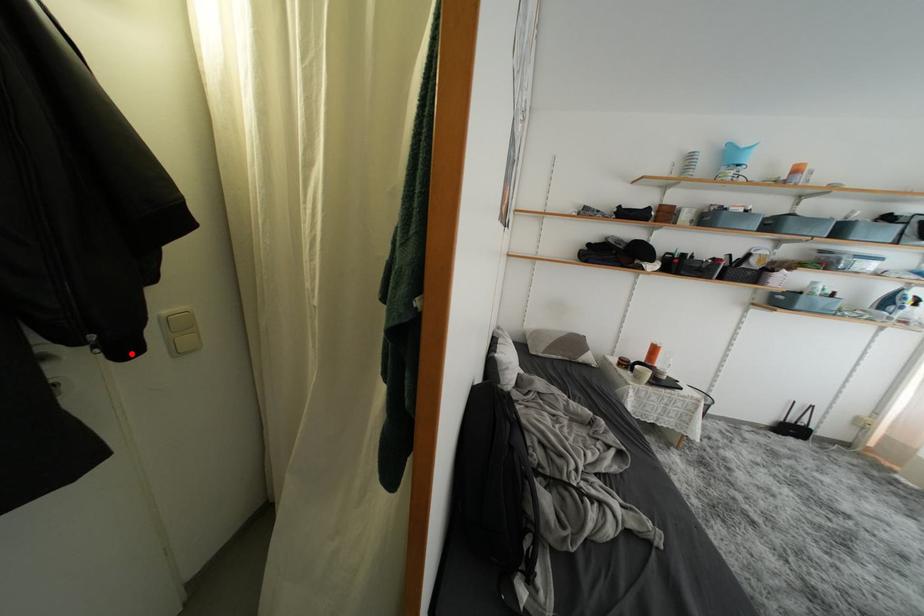
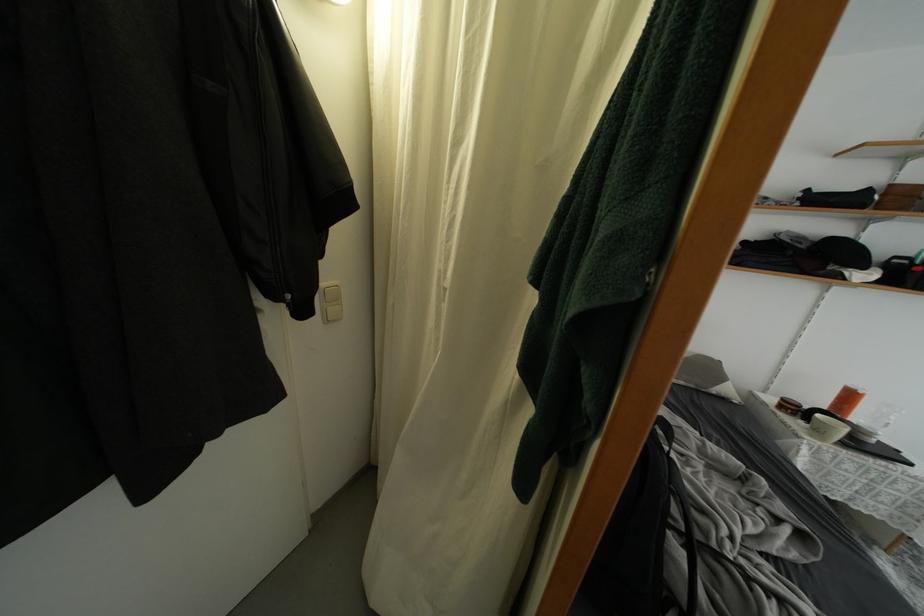
Question: I am providing you with two images of the same scene from different viewpoints. Given a red point in image1, look at the same physical point in image2. Is it:

Choices:
 (A) Closer to the viewpoint
 (B) Farther from the viewpoint

Answer: (A)